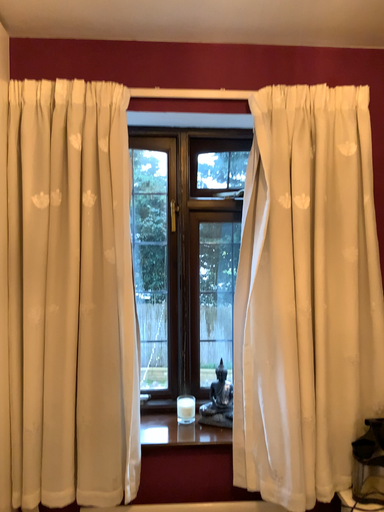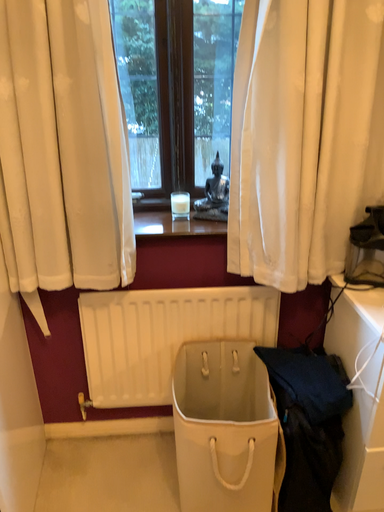
Question: How did the camera likely rotate when shooting the video?

Choices:
 (A) rotated upward
 (B) rotated downward

Answer: (B)